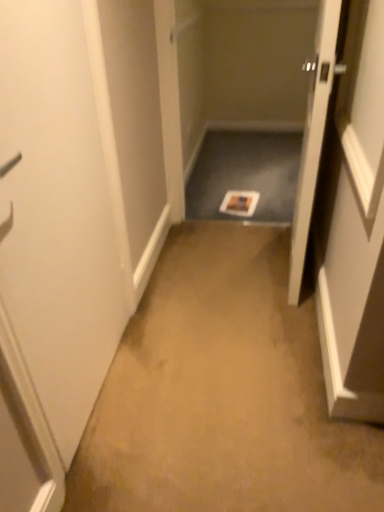
Question: Is wooden door at right, the second door from the left, completely or partially outside of matte gray tray at center?

Choices:
 (A) yes
 (B) no

Answer: (A)

Question: Considering the relative sizes of wooden door at right, the second door from the left, and matte gray tray at center in the image provided, is wooden door at right, the second door from the left, taller than matte gray tray at center?

Choices:
 (A) no
 (B) yes

Answer: (B)

Question: Is wooden door at right, the second door from the left, oriented away from matte gray tray at center?

Choices:
 (A) no
 (B) yes

Answer: (A)

Question: Can you confirm if wooden door at right, acting as the 1th door starting from the right, is thinner than matte gray tray at center?

Choices:
 (A) no
 (B) yes

Answer: (B)

Question: Is the surface of wooden door at right, the second door from the left, in direct contact with matte gray tray at center?

Choices:
 (A) yes
 (B) no

Answer: (B)

Question: In terms of size, does white matte door at left, the first door in the left-to-right sequence, appear bigger or smaller than wooden door at right, the second door from the left?

Choices:
 (A) small
 (B) big

Answer: (A)

Question: In the image, is white matte door at left, the first door in the left-to-right sequence, positioned in front of or behind wooden door at right, acting as the 1th door starting from the right?

Choices:
 (A) front
 (B) behind

Answer: (A)

Question: From a real-world perspective, is white matte door at left, the first door in the left-to-right sequence, above or below wooden door at right, the second door from the left?

Choices:
 (A) below
 (B) above

Answer: (B)

Question: Visually, is white matte door at left, the first door in the left-to-right sequence, positioned to the left or to the right of wooden door at right, the second door from the left?

Choices:
 (A) left
 (B) right

Answer: (A)

Question: From the image's perspective, is matte gray tray at center above or below wooden door at right, acting as the 1th door starting from the right?

Choices:
 (A) above
 (B) below

Answer: (A)

Question: From a real-world perspective, is matte gray tray at center above or below wooden door at right, the second door from the left?

Choices:
 (A) below
 (B) above

Answer: (A)

Question: Is matte gray tray at center spatially inside wooden door at right, the second door from the left, or outside of it?

Choices:
 (A) inside
 (B) outside

Answer: (B)

Question: Is matte gray tray at center to the left or to the right of wooden door at right, acting as the 1th door starting from the right, in the image?

Choices:
 (A) right
 (B) left

Answer: (B)

Question: Looking at their shapes, would you say white matte door at left, the second door positioned from the right, is wider or thinner than matte gray tray at center?

Choices:
 (A) wide
 (B) thin

Answer: (B)

Question: Is white matte door at left, the second door positioned from the right, taller or shorter than matte gray tray at center?

Choices:
 (A) short
 (B) tall

Answer: (B)